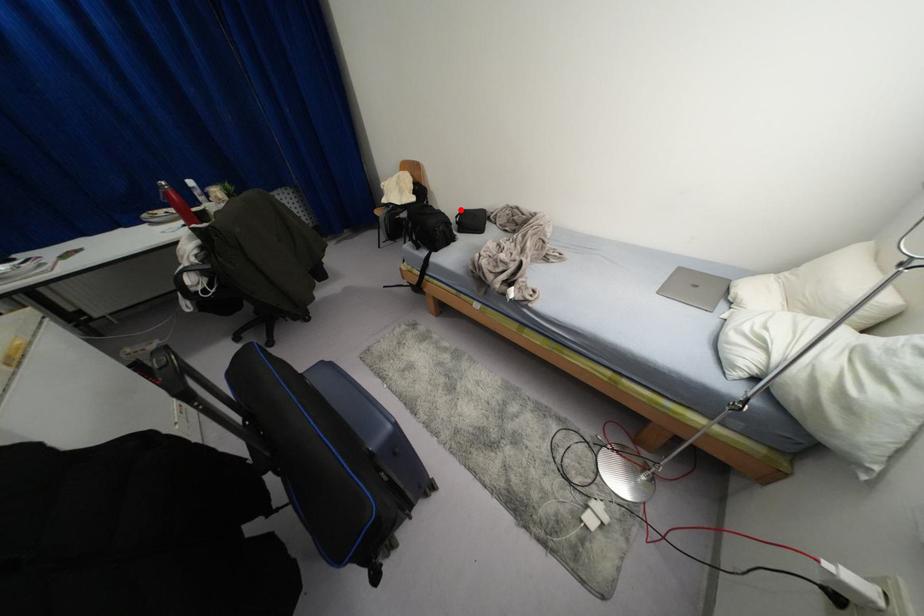
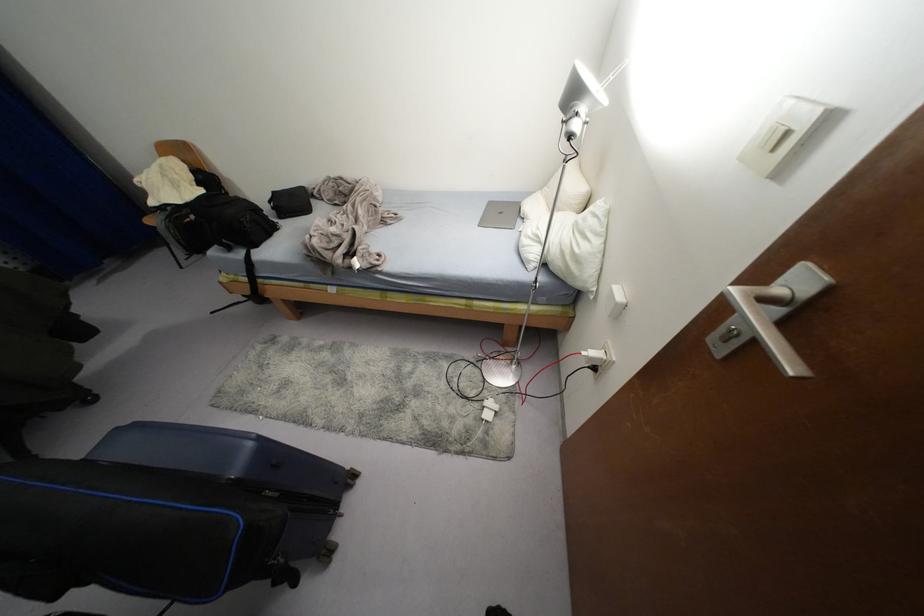
Find the pixel in the second image that matches the highlighted location in the first image.

(274, 192)